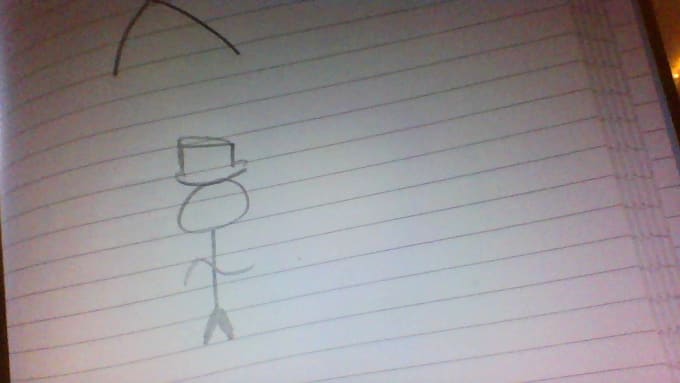
I want to click on light, so click(677, 75).